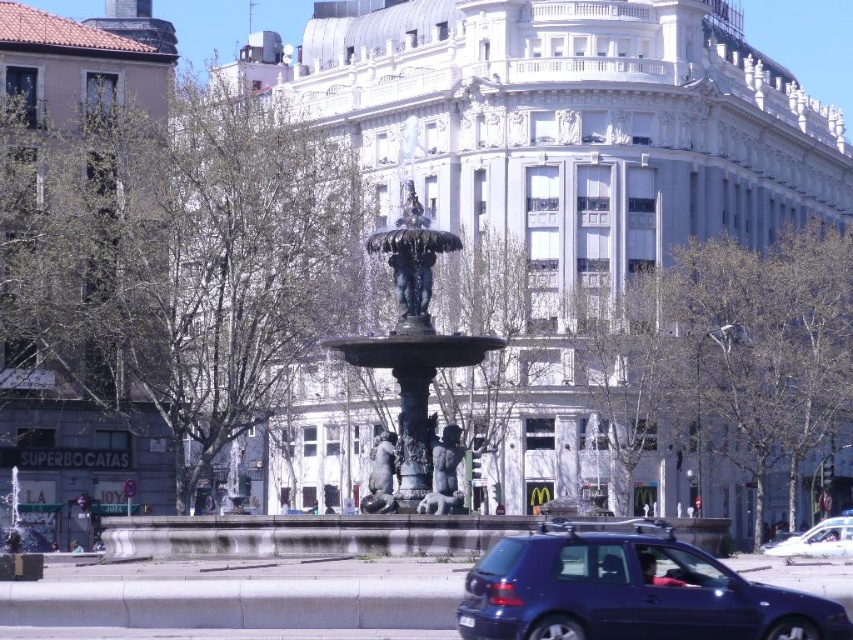
You are standing at the point with coordinates point [518,285] and want to walk towards the fountain. Is the point point [795,593] blocking your path?

Point [795,593] is in front of point [518,285], so yes, the point point [795,593] is blocking your path.

Based on the photo, you are standing in the urban scene looking at the fountain and the surrounding area. There are two points marked in the image. The first point is at coordinates point [204,209] and the second is at point [491,228]. Which point is nearer to you?

Point [204,209] is closer to the viewer than point [491,228].